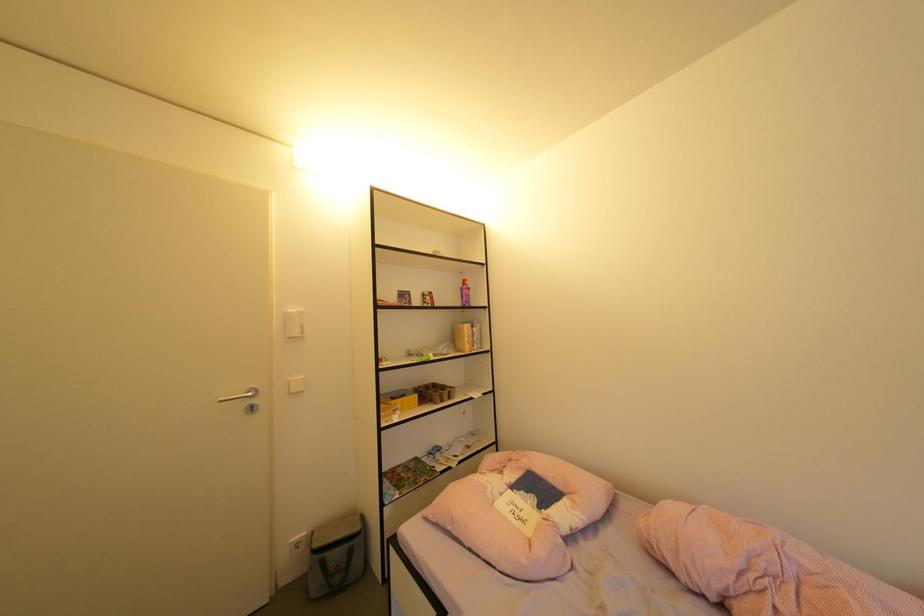
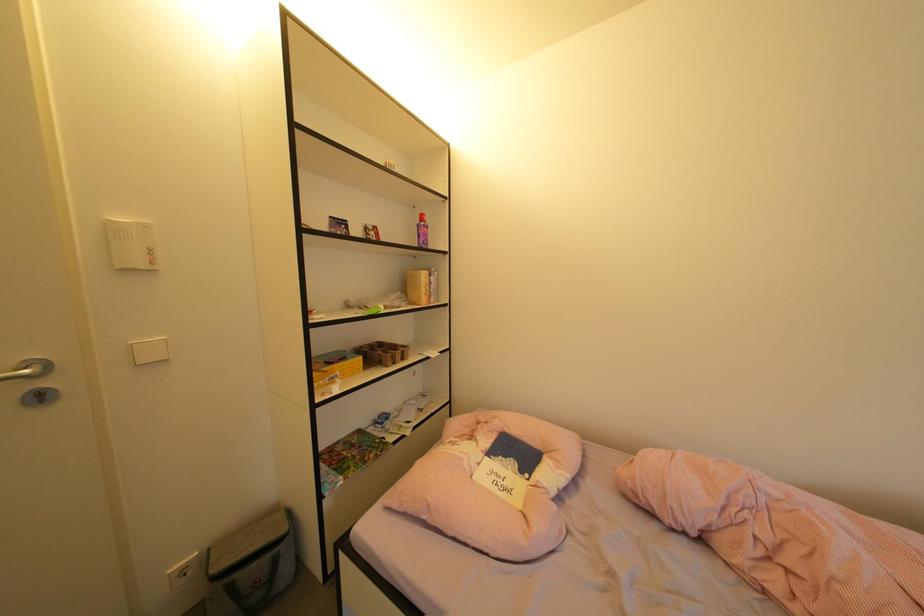
Question: The camera is either moving clockwise (left) or counter-clockwise (right) around the object. The first image is from the beginning of the video and the second image is from the end. Is the camera moving left or right when shooting the video?

Choices:
 (A) Left
 (B) Right

Answer: (A)